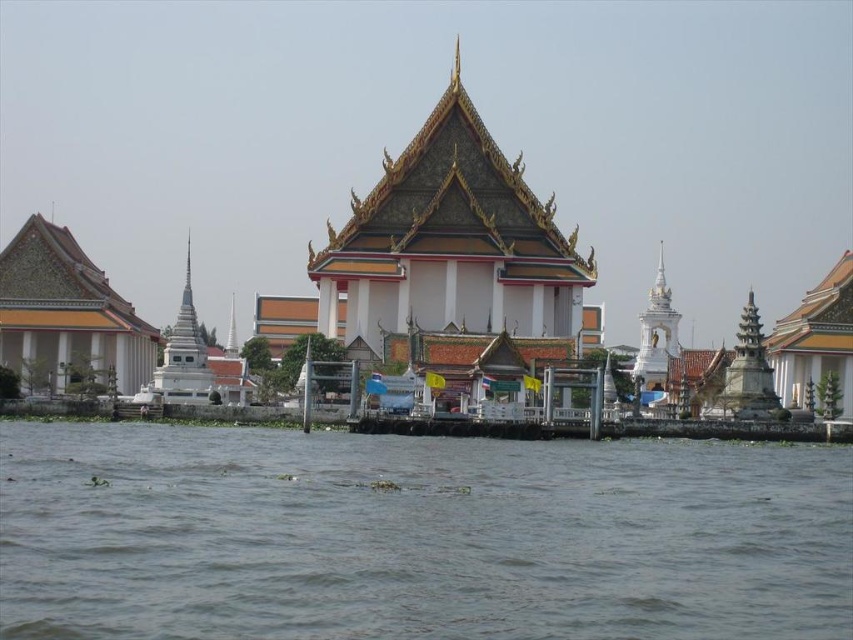
Can you confirm if white stone temple at center is positioned to the right of brown murky water at lower center?

Indeed, white stone temple at center is positioned on the right side of brown murky water at lower center.

In the scene shown: Who is more forward, (144, 243) or (461, 476)?

Positioned in front is point (461, 476).

Image resolution: width=853 pixels, height=640 pixels. What are the coordinates of `white stone temple at center` in the screenshot? It's located at (438, 157).